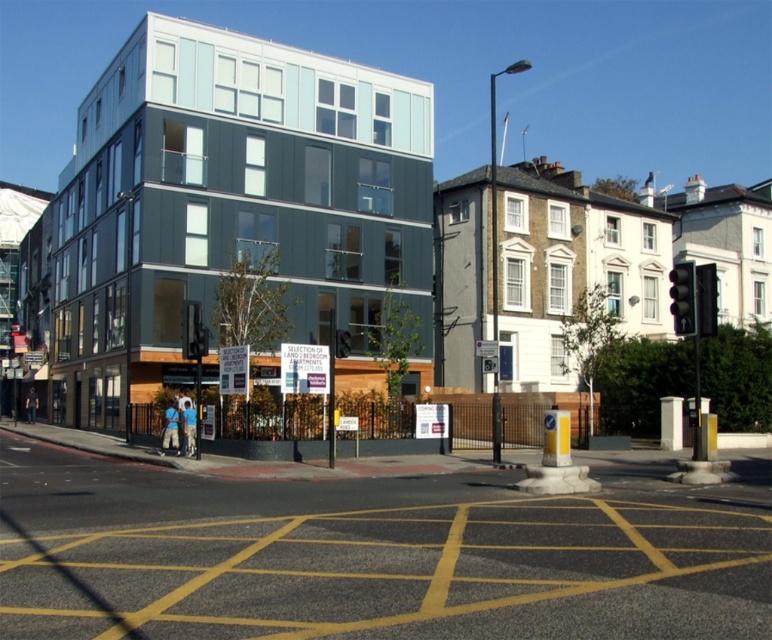
Who is shorter, metallic traffic light at right or black plastic traffic light at right?

Standing shorter between the two is black plastic traffic light at right.

Between metallic traffic light at right and black plastic traffic light at right, which one is positioned lower?

metallic traffic light at right

What do you see at coordinates (682, 298) in the screenshot?
I see `metallic traffic light at right` at bounding box center [682, 298].

What are the coordinates of `metallic traffic light at right` in the screenshot? It's located at (682, 298).